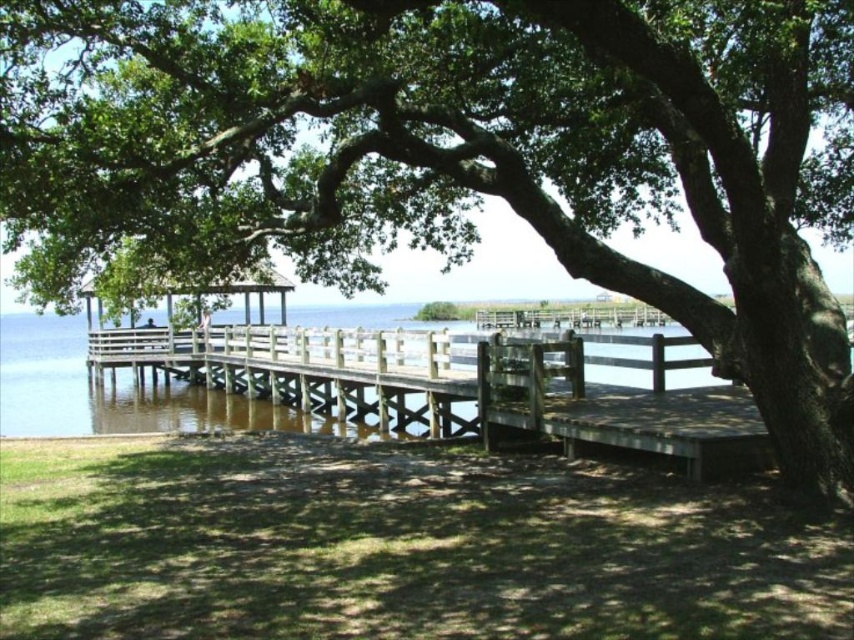
You are a visitor at the lakeside and want to take a photo of the wooden water at center and the white wooden gazebo at center. Which object should you focus on first if you want to capture both in a single frame without moving the camera?

The wooden water at center is taller than the white wooden gazebo at center, so you should focus on the wooden water at center first to ensure both are in frame.

You are standing on the wooden dock and want to reach the white wooden gazebo at center. Which direction should you move to get there from the wooden water at center?

The white wooden gazebo at center is located above the wooden water at center, so you should move upward to reach it.

You are planning to take a photo of the white wooden gazebo at center and the wooden water at center from the lakeside. Which object should you focus on first if you want to capture both in one shot without moving the camera?

You should focus on the wooden water at center first because the white wooden gazebo at center is behind it, so adjusting the focus to the closer object ensures both will be in the frame.